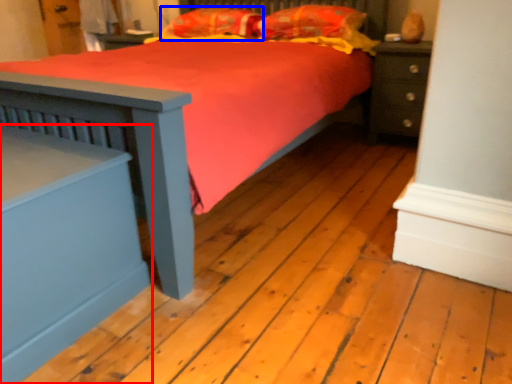
Question: Which point is closer to the camera, nightstand (highlighted by a red box) or pillow (highlighted by a blue box)?

Choices:
 (A) nightstand
 (B) pillow

Answer: (A)